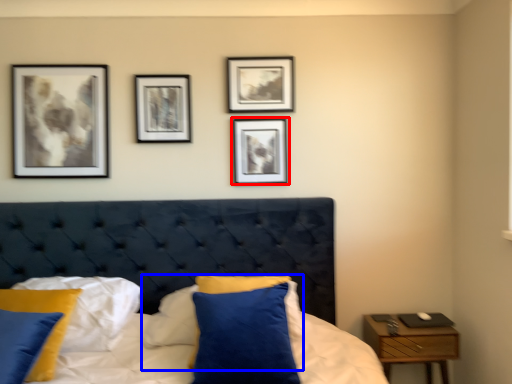
Question: Among these objects, which one is nearest to the camera, picture frame (highlighted by a red box) or pillow (highlighted by a blue box)?

Choices:
 (A) picture frame
 (B) pillow

Answer: (B)